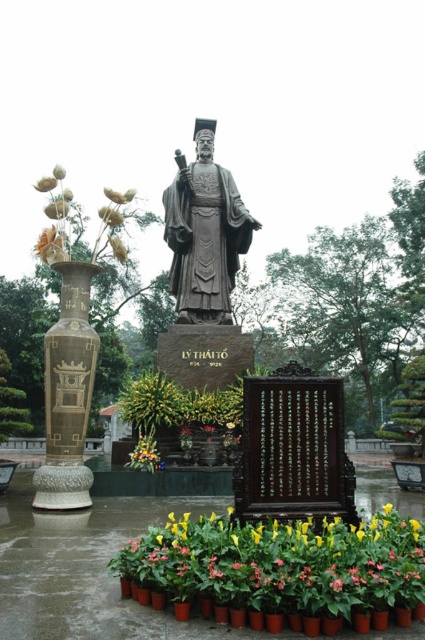
Question: Which point appears closest to the camera in this image?

Choices:
 (A) (201, 147)
 (B) (266, 593)

Answer: (B)

Question: Does stone statue at center have a lesser width compared to yellow matte flower at center?

Choices:
 (A) yes
 (B) no

Answer: (B)

Question: Which point is farther to the camera?

Choices:
 (A) yellow matte flower at center
 (B) stone statue at center

Answer: (B)

Question: Can you confirm if stone statue at center is bigger than yellow matte flower at center?

Choices:
 (A) no
 (B) yes

Answer: (B)

Question: Among these points, which one is nearest to the camera?

Choices:
 (A) (175, 192)
 (B) (146, 460)
 (C) (354, 580)

Answer: (C)

Question: Does floral arrangement at lower center appear on the right side of stone statue at center?

Choices:
 (A) yes
 (B) no

Answer: (A)